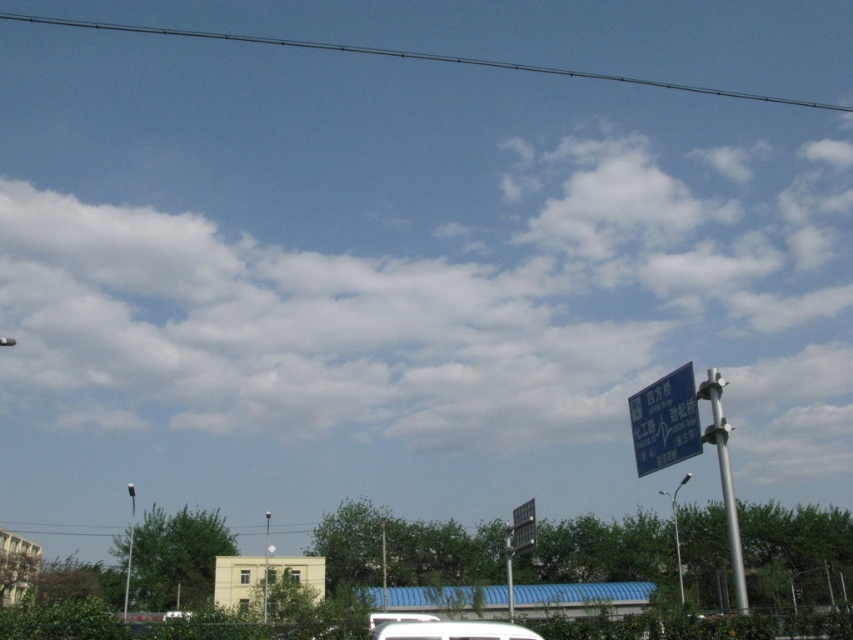
Question: Which of the following is the closest to the observer?

Choices:
 (A) white matte van at lower center
 (B) clear glass power line at upper center
 (C) white matte car at lower center

Answer: (C)

Question: Does blue metallic sign at upper right have a greater width compared to silver metallic pole at right?

Choices:
 (A) yes
 (B) no

Answer: (B)

Question: Which of these objects is positioned closest to the white matte car at lower center?

Choices:
 (A) black plastic street sign at center
 (B) metallic pole at lower left

Answer: (A)

Question: Which of the following is the closest to the observer?

Choices:
 (A) (372, 625)
 (B) (386, 595)
 (C) (265, 570)

Answer: (A)

Question: Is blue metallic sign at upper right smaller than white matte car at lower center?

Choices:
 (A) yes
 (B) no

Answer: (B)

Question: Does black plastic street sign at center appear under metallic pole at center?

Choices:
 (A) yes
 (B) no

Answer: (A)